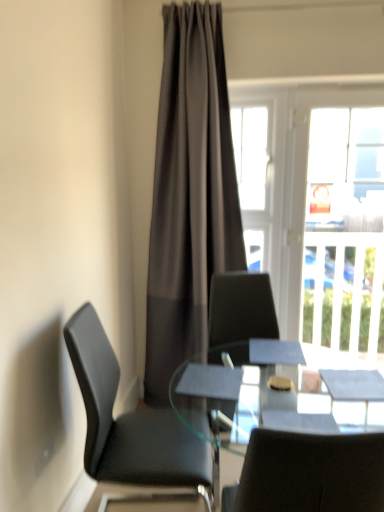
Locate an element on the screen. This screenshot has height=512, width=384. dark gray sheer curtain at center is located at coordinates (189, 194).

The width and height of the screenshot is (384, 512). What do you see at coordinates (189, 194) in the screenshot?
I see `dark gray sheer curtain at center` at bounding box center [189, 194].

Describe the element at coordinates (129, 422) in the screenshot. I see `black leather chair at left` at that location.

Image resolution: width=384 pixels, height=512 pixels. I want to click on clear glass window at upper right, so click(316, 208).

You are a GUI agent. You are given a task and a screenshot of the screen. Output one action in this format:
    pyautogui.click(x=<x>, y=<y>)
    Task: Click on the dark gray sheer curtain at center
    
    Given the screenshot: What is the action you would take?
    pyautogui.click(x=189, y=194)

Considering the sizes of objects dark gray sheer curtain at center and clear glass window at upper right in the image provided, who is smaller, dark gray sheer curtain at center or clear glass window at upper right?

Smaller between the two is clear glass window at upper right.

Is dark gray sheer curtain at center taller or shorter than clear glass window at upper right?

In the image, dark gray sheer curtain at center appears to be taller than clear glass window at upper right.

Considering the positions of objects dark gray sheer curtain at center and clear glass window at upper right in the image provided, who is more to the right, dark gray sheer curtain at center or clear glass window at upper right?

From the viewer's perspective, clear glass window at upper right appears more on the right side.

From a real-world perspective, between dark gray sheer curtain at center and black leather chair at left, who is vertically higher?

dark gray sheer curtain at center is physically above.

In the scene shown: Is dark gray sheer curtain at center facing away from black leather chair at left?

No, dark gray sheer curtain at center is not facing the opposite direction of black leather chair at left.

Is dark gray sheer curtain at center smaller than black leather chair at left?

No, dark gray sheer curtain at center is not smaller than black leather chair at left.

Which point is more forward, (234,224) or (155,484)?

The point (155,484) is in front.

Is black leather chair at left positioned before dark gray sheer curtain at center?

Yes, it is.

Does black leather chair at left turn towards dark gray sheer curtain at center?

No, black leather chair at left is not facing towards dark gray sheer curtain at center.

Looking at their sizes, would you say black leather chair at left is wider or thinner than dark gray sheer curtain at center?

Clearly, black leather chair at left has more width compared to dark gray sheer curtain at center.

In the scene shown: Considering the positions of objects black leather chair at left and dark gray sheer curtain at center in the image provided, who is more to the right, black leather chair at left or dark gray sheer curtain at center?

From the viewer's perspective, dark gray sheer curtain at center appears more on the right side.

From the image's perspective, between clear glass window at upper right and dark gray sheer curtain at center, who is located below?

From the image's view, clear glass window at upper right is below.

From a real-world perspective, between clear glass window at upper right and dark gray sheer curtain at center, who is vertically higher?

Result: dark gray sheer curtain at center is physically above.

Which object is thinner, clear glass window at upper right or dark gray sheer curtain at center?

clear glass window at upper right.

Is dark gray sheer curtain at center at the back of clear glass window at upper right?

No, dark gray sheer curtain at center is not at the back of clear glass window at upper right.

Is black leather chair at left far from transparent glass table at center?

Actually, black leather chair at left and transparent glass table at center are a little close together.

From a real-world perspective, is black leather chair at left positioned over transparent glass table at center based on gravity?

Yes, from a real-world perspective, black leather chair at left is above transparent glass table at center.

Consider the image. Could you tell me if black leather chair at left is facing transparent glass table at center?

Yes, black leather chair at left is turned towards transparent glass table at center.

The image size is (384, 512). In order to click on chair that is on the left side of transparent glass table at center in this screenshot , I will do `click(129, 422)`.

Is transparent glass table at center beside clear glass window at upper right?

No, transparent glass table at center is not next to clear glass window at upper right.

How far apart are transparent glass table at center and clear glass window at upper right?

transparent glass table at center is 2.12 meters away from clear glass window at upper right.

Does transparent glass table at center have a greater height compared to clear glass window at upper right?

In fact, transparent glass table at center may be shorter than clear glass window at upper right.

From the image's perspective, who appears lower, transparent glass table at center or clear glass window at upper right?

transparent glass table at center is shown below in the image.

Is black leather chair at left inside or outside of clear glass window at upper right?

black leather chair at left lies outside clear glass window at upper right.

Can you confirm if black leather chair at left is taller than clear glass window at upper right?

In fact, black leather chair at left may be shorter than clear glass window at upper right.

From the picture: From the image's perspective, is black leather chair at left over clear glass window at upper right?

No, from the image's perspective, black leather chair at left is not above clear glass window at upper right.

Considering the relative positions of black leather chair at left and clear glass window at upper right in the image provided, is black leather chair at left to the left or to the right of clear glass window at upper right?

Based on their positions, black leather chair at left is located to the left of clear glass window at upper right.

Where is `curtain lying in front of the clear glass window at upper right`? The image size is (384, 512). curtain lying in front of the clear glass window at upper right is located at coordinates (189, 194).

The height and width of the screenshot is (512, 384). I want to click on curtain above the black leather chair at left (from a real-world perspective), so click(189, 194).

Which object lies nearer to the anchor point dark gray sheer curtain at center, transparent glass table at center or clear glass window at upper right?

Among the two, clear glass window at upper right is located nearer to dark gray sheer curtain at center.

Considering their positions, is dark gray sheer curtain at center positioned closer to clear glass window at upper right than black leather chair at left?

dark gray sheer curtain at center lies closer to clear glass window at upper right than the other object.

Which object lies further to the anchor point clear glass window at upper right, transparent glass table at center or black leather chair at left?

transparent glass table at center is further to clear glass window at upper right.

Based on the photo, looking at the image, which one is located closer to clear glass window at upper right, dark gray sheer curtain at center or transparent glass table at center?

The object closer to clear glass window at upper right is dark gray sheer curtain at center.

When comparing their distances from clear glass window at upper right, does black leather chair at left or transparent glass table at center seem closer?

black leather chair at left is positioned closer to the anchor clear glass window at upper right.

Considering their positions, is clear glass window at upper right positioned further to black leather chair at left than dark gray sheer curtain at center?

Among the two, clear glass window at upper right is located further to black leather chair at left.

Looking at the image, which one is located closer to dark gray sheer curtain at center, black leather chair at left or clear glass window at upper right?

Based on the image, clear glass window at upper right appears to be nearer to dark gray sheer curtain at center.

From the image, which object appears to be farther from dark gray sheer curtain at center, black leather chair at left or transparent glass table at center?

transparent glass table at center is positioned further to the anchor dark gray sheer curtain at center.

Locate an element on the screen. Image resolution: width=384 pixels, height=512 pixels. chair between dark gray sheer curtain at center and transparent glass table at center from top to bottom is located at coordinates (129, 422).

The image size is (384, 512). I want to click on curtain located between transparent glass table at center and clear glass window at upper right in the depth direction, so click(x=189, y=194).

Where is `curtain situated between black leather chair at left and clear glass window at upper right from left to right`? curtain situated between black leather chair at left and clear glass window at upper right from left to right is located at coordinates (189, 194).

At what (x,y) coordinates should I click in order to perform the action: click on chair between transparent glass table at center and clear glass window at upper right along the z-axis. Please return your answer as a coordinate pair (x, y). Looking at the image, I should click on (129, 422).